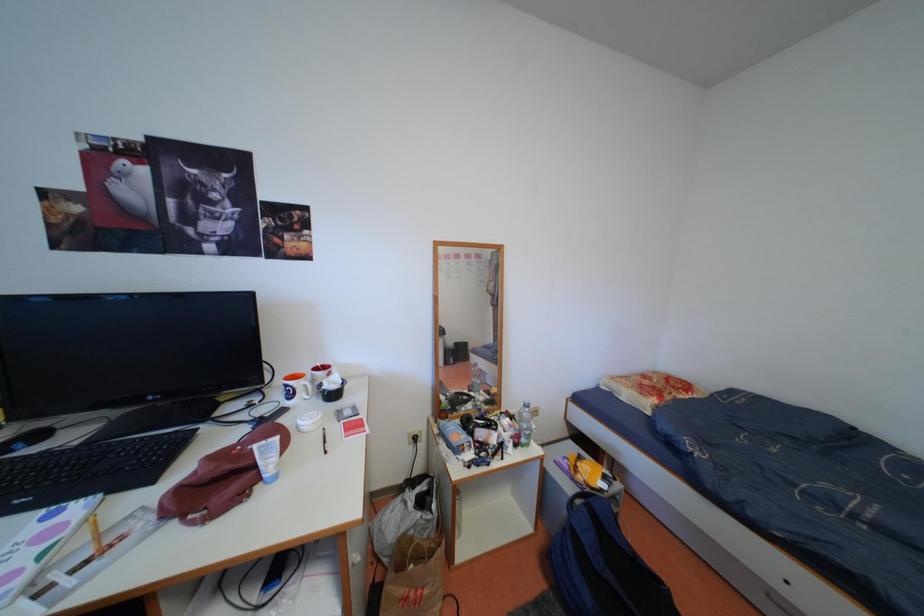
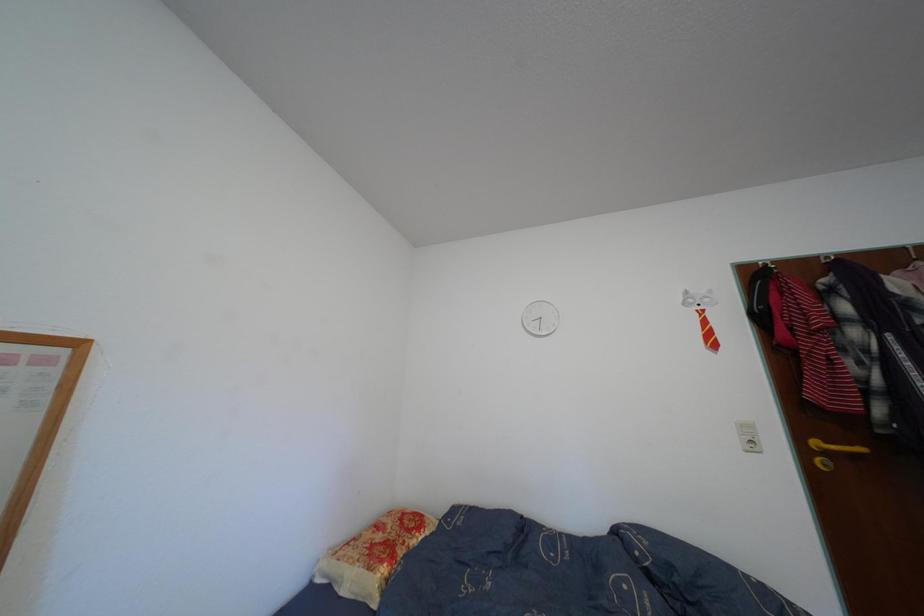
First-person continuous shooting, in which direction is the camera rotating?

The camera rotated toward right-up.